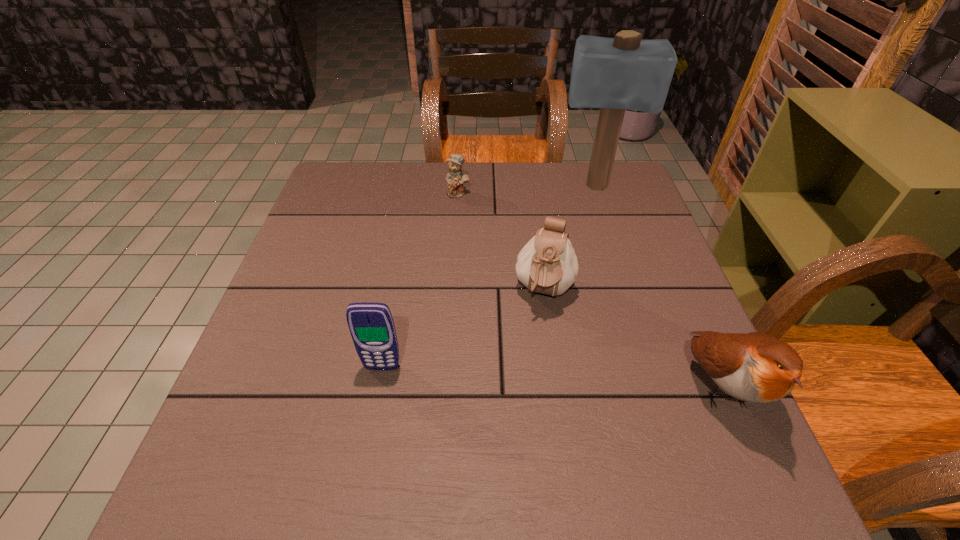
Identify the location of cellular telephone. (371, 325).

Where is `bird`? bird is located at coordinates (754, 367).

Where is `the fourth object from right to left`? the fourth object from right to left is located at coordinates (456, 177).

This screenshot has height=540, width=960. I want to click on the shortest object, so click(456, 177).

Where is `pouch`? This screenshot has width=960, height=540. pouch is located at coordinates (547, 264).

Where is `the third object from right to left`? the third object from right to left is located at coordinates (547, 264).

The height and width of the screenshot is (540, 960). I want to click on mallet, so click(x=614, y=74).

This screenshot has width=960, height=540. Identify the location of free location located on the front-facing side of the leftmost object. (373, 415).

Locate an element on the screen. This screenshot has height=540, width=960. vacant space situated on the front-facing side of the teddy bear is located at coordinates (482, 226).

I want to click on vacant space situated 0.400m on the front-facing side of the teddy bear, so click(531, 295).